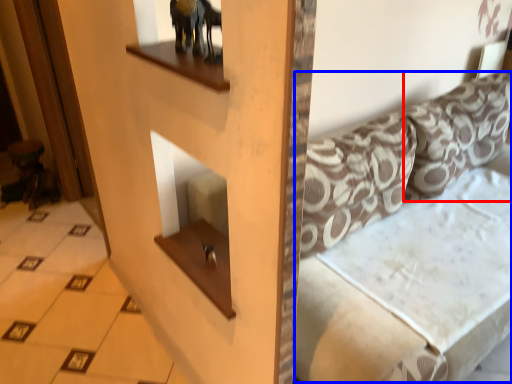
Question: Which object is further to the camera taking this photo, pillow (highlighted by a red box) or couch (highlighted by a blue box)?

Choices:
 (A) pillow
 (B) couch

Answer: (A)